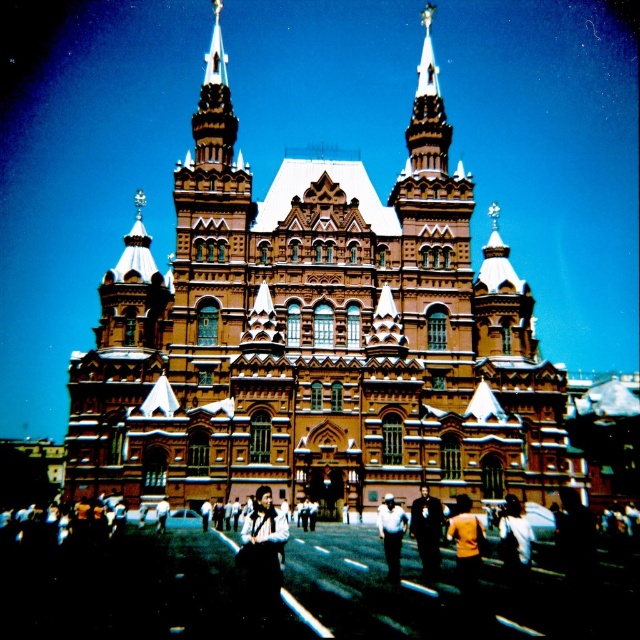
Is orange shirt at center thinner than white cotton shirt at center?

In fact, orange shirt at center might be wider than white cotton shirt at center.

Image resolution: width=640 pixels, height=640 pixels. What do you see at coordinates (465, 544) in the screenshot? I see `orange shirt at center` at bounding box center [465, 544].

What do you see at coordinates (465, 544) in the screenshot? I see `orange shirt at center` at bounding box center [465, 544].

I want to click on orange shirt at center, so click(x=465, y=544).

Describe the element at coordinates (314, 342) in the screenshot. I see `brown stone church at center` at that location.

Between brown stone church at center and white cotton shirt at center, which one is positioned lower?

white cotton shirt at center is below.

Locate an element on the screen. brown stone church at center is located at coordinates (314, 342).

Does gold ornate spire at upper center have a greater height compared to white shirt at center?

Indeed, gold ornate spire at upper center has a greater height compared to white shirt at center.

Is point (424, 35) closer to viewer compared to point (525, 552)?

No, (424, 35) is further to viewer.

Locate an element on the screen. The width and height of the screenshot is (640, 640). gold ornate spire at upper center is located at coordinates (428, 113).

Where is `gold ornate spire at upper center`? gold ornate spire at upper center is located at coordinates (428, 113).